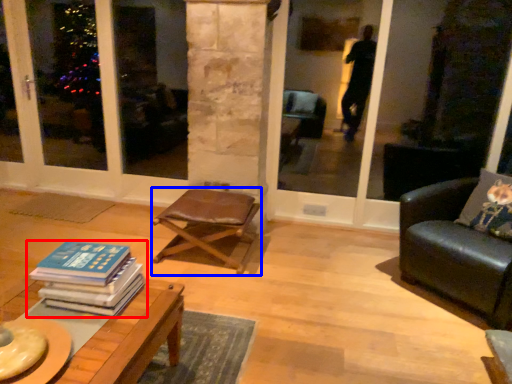
Question: Which point is closer to the camera, book (highlighted by a red box) or chair (highlighted by a blue box)?

Choices:
 (A) book
 (B) chair

Answer: (A)